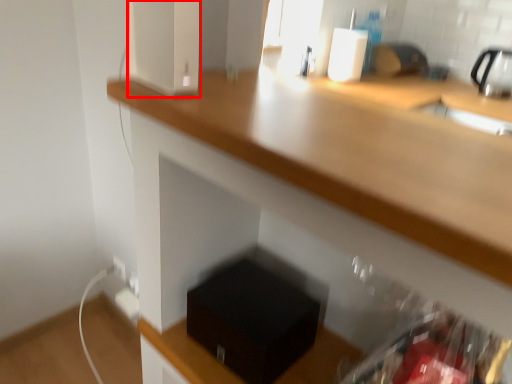
Question: In this image, where is appliance (annotated by the red box) located relative to box?

Choices:
 (A) right
 (B) left

Answer: (B)